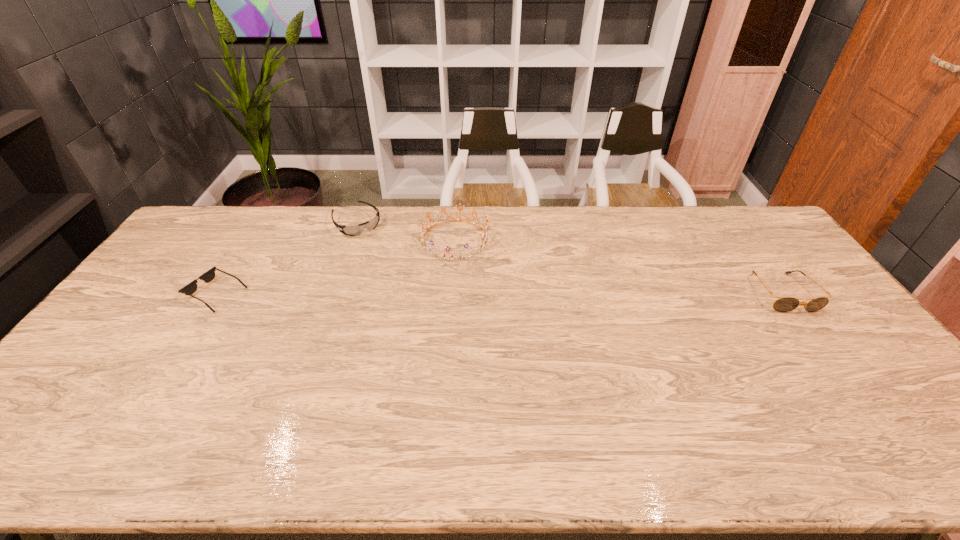
The width and height of the screenshot is (960, 540). In order to click on blank space located 0.090m on the front-facing side of the second tallest object in this screenshot , I will do click(815, 338).

This screenshot has height=540, width=960. Identify the location of free point located 0.150m on the front-facing side of the third object from left to right. (519, 271).

Find the location of a particular element. vacant space located 0.280m on the front-facing side of the third object from left to right is located at coordinates (554, 287).

The image size is (960, 540). Identify the location of vacant space located on the front-facing side of the third object from left to right. (499, 261).

Find the location of a particular element. This screenshot has width=960, height=540. free location located on the lenses of the second sunglasses from right to left is located at coordinates (406, 276).

This screenshot has height=540, width=960. Identify the location of vacant position located 0.250m on the lenses of the second sunglasses from right to left. (401, 272).

Where is `free location located 0.060m on the lenses of the second sunglasses from right to left`? Image resolution: width=960 pixels, height=540 pixels. free location located 0.060m on the lenses of the second sunglasses from right to left is located at coordinates (375, 243).

Identify the location of tiara located at the far edge. This screenshot has width=960, height=540. (484, 241).

This screenshot has width=960, height=540. Find the location of `sunglasses located at the far edge`. sunglasses located at the far edge is located at coordinates (x=355, y=230).

At what (x,y) coordinates should I click in order to perform the action: click on object that is at the left edge. Please return your answer as a coordinate pair (x, y). The height and width of the screenshot is (540, 960). Looking at the image, I should click on (207, 277).